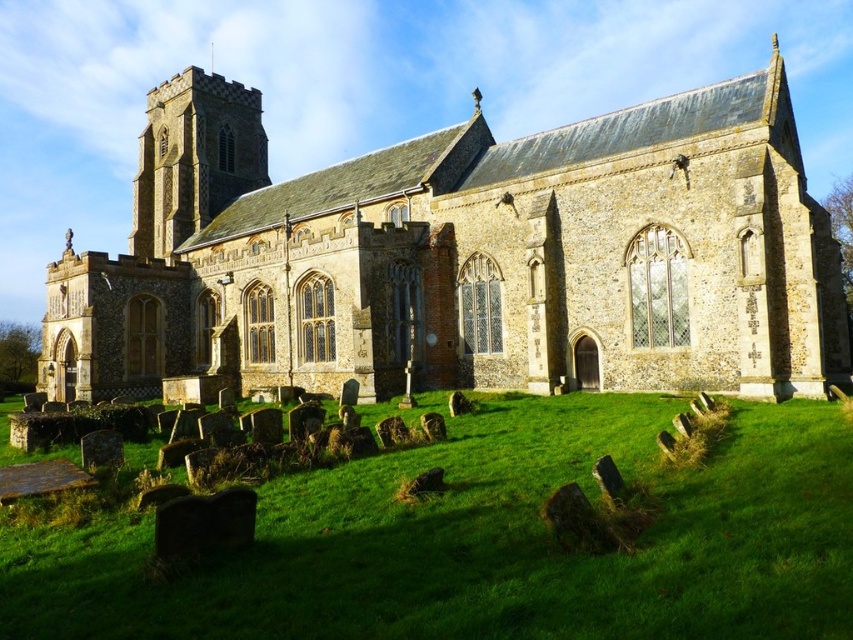
You are standing at the edge of the green grass at lower center and want to walk directly towards the brown stone church at center. Is the church wider than the grass area you are standing on?

The brown stone church at center might be wider than green grass at lower center, so it is possible that the church is wider than the grass area you are standing on.

You are standing at the entrance of the historic stone church and want to visit both the point at coordinates point (622, 218) and the point at coordinates point (469, 451). Which point should you visit first to ensure you don???t have to backtrack?

You should visit point (469, 451) first because it is in front of point (622, 218). This way, you can proceed towards the church and avoid backtracking.